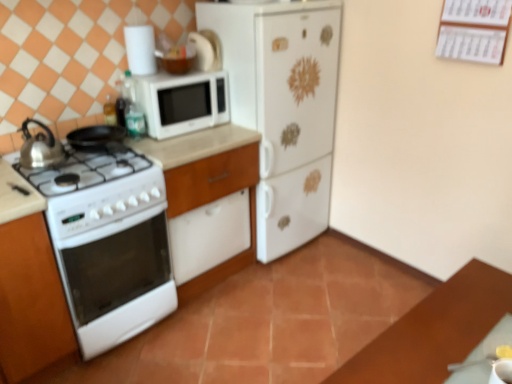
Describe the element at coordinates (183, 102) in the screenshot. I see `white matte microwave at upper center` at that location.

Where is `white matte cabinet at left`? This screenshot has height=384, width=512. white matte cabinet at left is located at coordinates (31, 301).

At what (x,y) coordinates should I click in order to perform the action: click on white paper calendar at upper right. Please return your answer as a coordinate pair (x, y). This screenshot has width=512, height=384. Looking at the image, I should click on (474, 30).

Where is `white matte refrigerator at center`? The height and width of the screenshot is (384, 512). white matte refrigerator at center is located at coordinates (284, 108).

I want to click on shiny metallic kettle at left, so click(x=40, y=148).

Where is `white glossy dishwasher at center`? This screenshot has width=512, height=384. white glossy dishwasher at center is located at coordinates (208, 184).

This screenshot has height=384, width=512. Describe the element at coordinates (208, 184) in the screenshot. I see `white glossy dishwasher at center` at that location.

The width and height of the screenshot is (512, 384). I want to click on white matte microwave at upper center, so click(x=183, y=102).

How different are the orientations of white matte microwave at upper center and white glossy oven at left in degrees?

There is a 3.52e-05-degree angle between the facing directions of white matte microwave at upper center and white glossy oven at left.

Considering the relative sizes of white matte microwave at upper center and white glossy oven at left in the image provided, is white matte microwave at upper center bigger than white glossy oven at left?

No, white matte microwave at upper center is not bigger than white glossy oven at left.

Does point (187, 79) lie in front of point (170, 276)?

Yes, point (187, 79) is in front of point (170, 276).

Could you tell me if white matte cabinet at left is facing white glossy countertop at lower left?

No, white matte cabinet at left is not turned towards white glossy countertop at lower left.

Considering their positions, is white matte cabinet at left located in front of or behind white glossy countertop at lower left?

Visually, white matte cabinet at left is located in front of white glossy countertop at lower left.

Which of these two, white matte cabinet at left or white glossy countertop at lower left, is smaller?

Smaller between the two is white glossy countertop at lower left.

What's the angular difference between white matte cabinet at left and white glossy countertop at lower left's facing directions?

There is a 0.00751-degree angle between the facing directions of white matte cabinet at left and white glossy countertop at lower left.

Identify the location of counter top on the left side of white matte refrigerator at center. (204, 164).

Looking at this image, can you confirm if white glossy countertop at lower left is wider than white matte refrigerator at center?

Yes.

From the picture: Would you say white glossy countertop at lower left is outside white matte refrigerator at center?

white glossy countertop at lower left is positioned outside white matte refrigerator at center.

Is white glossy oven at left outside of white matte microwave at upper center?

That's correct, white glossy oven at left is outside of white matte microwave at upper center.

Which point is more distant from viewer, (144, 295) or (184, 83)?

Positioned behind is point (184, 83).

Is white glossy oven at left taller or shorter than white matte microwave at upper center?

Clearly, white glossy oven at left is taller compared to white matte microwave at upper center.

Can white glossy countertop at lower left be found inside white glossy dishwasher at center?

No, white glossy countertop at lower left is not surrounded by white glossy dishwasher at center.

Is white glossy dishwasher at center in front of or behind white glossy countertop at lower left in the image?

white glossy dishwasher at center is behind white glossy countertop at lower left.

Considering the points (200, 153) and (227, 190), which point is in front, point (200, 153) or point (227, 190)?

The point (200, 153) is closer to the camera.

Based on the photo, does white glossy dishwasher at center have a larger size compared to white glossy countertop at lower left?

Result: Yes.

Who is shorter, white matte microwave at upper center or white glossy dishwasher at center?

With less height is white matte microwave at upper center.

Based on the photo, is white matte microwave at upper center placed right next to white glossy dishwasher at center?

white matte microwave at upper center and white glossy dishwasher at center are not in contact.

Is white matte microwave at upper center further to camera compared to white glossy dishwasher at center?

Yes, white matte microwave at upper center is behind white glossy dishwasher at center.

From the image's perspective, between white paper calendar at upper right and white glossy oven at left, which one is located above?

white paper calendar at upper right.

Between white paper calendar at upper right and white glossy oven at left, which one appears on the left side from the viewer's perspective?

Positioned to the left is white glossy oven at left.

Is white paper calendar at upper right far away from white glossy oven at left?

Yes.

Does white paper calendar at upper right have a lesser width compared to white glossy oven at left?

Correct, the width of white paper calendar at upper right is less than that of white glossy oven at left.

Where is `oven in front of the white matte microwave at upper center`? This screenshot has width=512, height=384. oven in front of the white matte microwave at upper center is located at coordinates (127, 320).

You are a GUI agent. You are given a task and a screenshot of the screen. Output one action in this format:
    pyautogui.click(x=<x>, y=<y>)
    Task: Click on the counter top that is on the right side of white matte cabinet at left
    Image resolution: width=512 pixels, height=384 pixels.
    Given the screenshot: What is the action you would take?
    pyautogui.click(x=204, y=164)

Considering their positions, is white matte refrigerator at center positioned further to white glossy oven at left than white glossy dishwasher at center?

white matte refrigerator at center is positioned further to the anchor white glossy oven at left.

Considering their positions, is white matte cabinet at left positioned further to white glossy dishwasher at center than white matte refrigerator at center?

white matte cabinet at left is further to white glossy dishwasher at center.

When comparing their distances from white glossy oven at left, does shiny metallic kettle at left or white paper calendar at upper right seem closer?

Among the two, shiny metallic kettle at left is located nearer to white glossy oven at left.

Considering their positions, is white glossy dishwasher at center positioned further to white matte refrigerator at center than white matte microwave at upper center?

Among the two, white matte microwave at upper center is located further to white matte refrigerator at center.

Looking at the image, which one is located closer to white matte microwave at upper center, white matte refrigerator at center or white glossy dishwasher at center?

white glossy dishwasher at center.

From the image, which object appears to be nearer to white matte microwave at upper center, white glossy dishwasher at center or white glossy oven at left?

white glossy dishwasher at center lies closer to white matte microwave at upper center than the other object.

From the image, which object appears to be nearer to white matte refrigerator at center, shiny metallic kettle at left or white glossy oven at left?

Among the two, white glossy oven at left is located nearer to white matte refrigerator at center.

When comparing their distances from white matte microwave at upper center, does white matte cabinet at left or white glossy oven at left seem further?

Based on the image, white matte cabinet at left appears to be further to white matte microwave at upper center.

Locate an element on the screen. The height and width of the screenshot is (384, 512). counter top between white matte microwave at upper center and white glossy oven at left vertically is located at coordinates (204, 164).

In order to click on oven between shiny metallic kettle at left and white paper calendar at upper right in this screenshot , I will do 127,320.

This screenshot has height=384, width=512. In order to click on oven situated between white glossy countertop at lower left and white glossy dishwasher at center from left to right in this screenshot , I will do `click(127, 320)`.

Identify the location of home appliance between white glossy oven at left and white paper calendar at upper right in the horizontal direction. (284, 108).